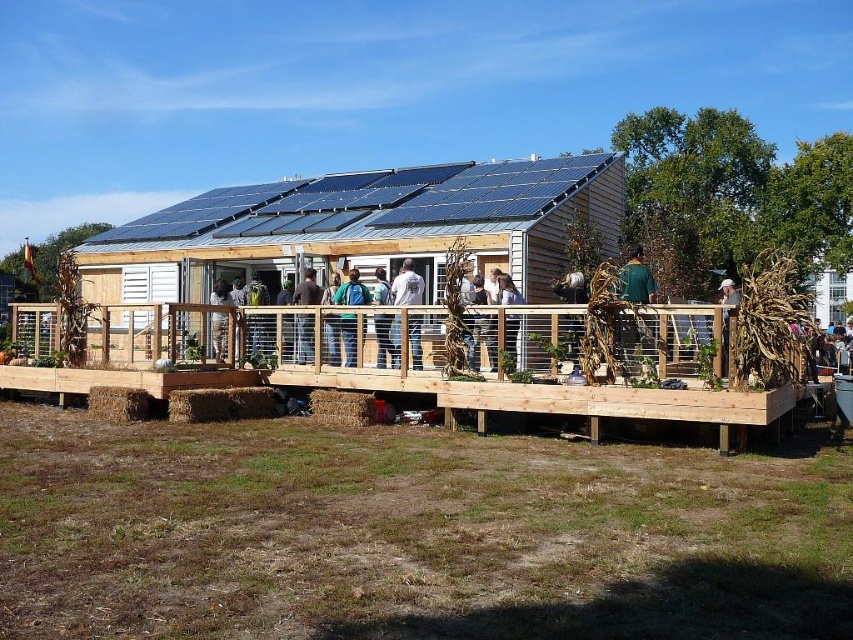
Question: Which point is closer to the camera taking this photo?

Choices:
 (A) (218, 282)
 (B) (352, 285)

Answer: (B)

Question: Estimate the real-world distances between objects in this image. Which object is farther from the white fabric shirt at center?

Choices:
 (A) dark brown leather jacket at center
 (B) green backpack at center

Answer: (A)

Question: Estimate the real-world distances between objects in this image. Which object is farther from the light brown wooden deck at center?

Choices:
 (A) light brown wooden fence at center
 (B) white fabric shirt at center
 (C) brown wooden post at center

Answer: (C)

Question: Observing the image, what is the correct spatial positioning of green backpack at center in reference to brown wooden post at center?

Choices:
 (A) right
 (B) left

Answer: (B)

Question: Does dark brown leather jacket at center appear on the right side of light brown wooden fence at center?

Choices:
 (A) yes
 (B) no

Answer: (B)

Question: Can you confirm if green fabric backpack at center is wider than brown wooden post at center?

Choices:
 (A) no
 (B) yes

Answer: (A)